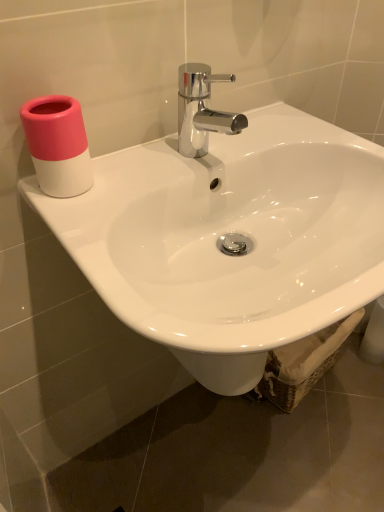
Question: From the image's perspective, is pink matte cup at upper left over white glossy sink at upper center?

Choices:
 (A) yes
 (B) no

Answer: (A)

Question: Are pink matte cup at upper left and white glossy sink at upper center making contact?

Choices:
 (A) yes
 (B) no

Answer: (B)

Question: Would you say pink matte cup at upper left is outside white glossy sink at upper center?

Choices:
 (A) yes
 (B) no

Answer: (A)

Question: Is pink matte cup at upper left smaller than white glossy sink at upper center?

Choices:
 (A) yes
 (B) no

Answer: (A)

Question: Can you confirm if pink matte cup at upper left is positioned to the left of white glossy sink at upper center?

Choices:
 (A) no
 (B) yes

Answer: (B)

Question: Does pink matte cup at upper left come in front of white glossy sink at upper center?

Choices:
 (A) no
 (B) yes

Answer: (A)

Question: Is white glossy sink at upper center thinner than pink matte cup at upper left?

Choices:
 (A) no
 (B) yes

Answer: (A)

Question: Is white glossy sink at upper center at the left side of pink matte cup at upper left?

Choices:
 (A) no
 (B) yes

Answer: (A)

Question: Is white glossy sink at upper center to the right of pink matte cup at upper left from the viewer's perspective?

Choices:
 (A) yes
 (B) no

Answer: (A)

Question: Is white glossy sink at upper center aimed at pink matte cup at upper left?

Choices:
 (A) no
 (B) yes

Answer: (A)

Question: Can you confirm if white glossy sink at upper center is bigger than pink matte cup at upper left?

Choices:
 (A) yes
 (B) no

Answer: (A)

Question: From the image's perspective, would you say white glossy sink at upper center is positioned over pink matte cup at upper left?

Choices:
 (A) no
 (B) yes

Answer: (A)

Question: Is white glossy sink at upper center taller or shorter than pink matte cup at upper left?

Choices:
 (A) short
 (B) tall

Answer: (B)